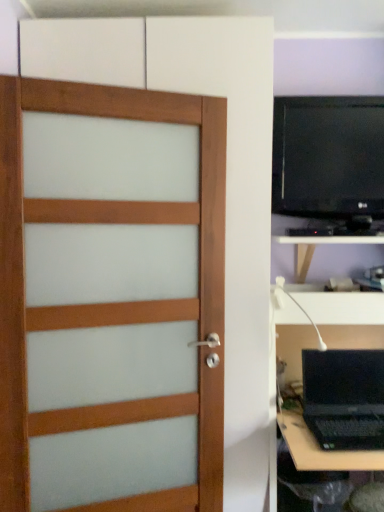
Question: Does black glossy monitor at upper right have a lesser height compared to satin wood door at left?

Choices:
 (A) yes
 (B) no

Answer: (A)

Question: Does black glossy monitor at upper right have a greater width compared to satin wood door at left?

Choices:
 (A) no
 (B) yes

Answer: (A)

Question: Is black glossy monitor at upper right to the right of satin wood door at left from the viewer's perspective?

Choices:
 (A) yes
 (B) no

Answer: (A)

Question: Does black glossy monitor at upper right lie behind satin wood door at left?

Choices:
 (A) no
 (B) yes

Answer: (B)

Question: From the image's perspective, is black glossy monitor at upper right on satin wood door at left?

Choices:
 (A) no
 (B) yes

Answer: (B)

Question: Is satin wood door at left a part of black glossy monitor at upper right?

Choices:
 (A) yes
 (B) no

Answer: (B)

Question: Is black matte laptop at lower right closer to camera compared to white plastic lamp at right?

Choices:
 (A) no
 (B) yes

Answer: (B)

Question: Is black matte laptop at lower right oriented away from white plastic lamp at right?

Choices:
 (A) no
 (B) yes

Answer: (A)

Question: Is black matte laptop at lower right bigger than white plastic lamp at right?

Choices:
 (A) no
 (B) yes

Answer: (B)

Question: Is black matte laptop at lower right thinner than white plastic lamp at right?

Choices:
 (A) no
 (B) yes

Answer: (B)

Question: Is black matte laptop at lower right outside of white plastic lamp at right?

Choices:
 (A) yes
 (B) no

Answer: (A)

Question: Are black matte laptop at lower right and white plastic lamp at right located far from each other?

Choices:
 (A) no
 (B) yes

Answer: (A)

Question: Can you confirm if white matte tv cabinet at lower right is shorter than satin wood door at left?

Choices:
 (A) yes
 (B) no

Answer: (A)